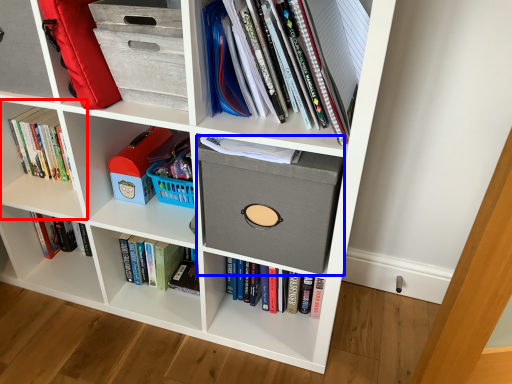
Question: Which object appears closest to the camera in this image, shelf (highlighted by a red box) or cardboard box (highlighted by a blue box)?

Choices:
 (A) shelf
 (B) cardboard box

Answer: (B)